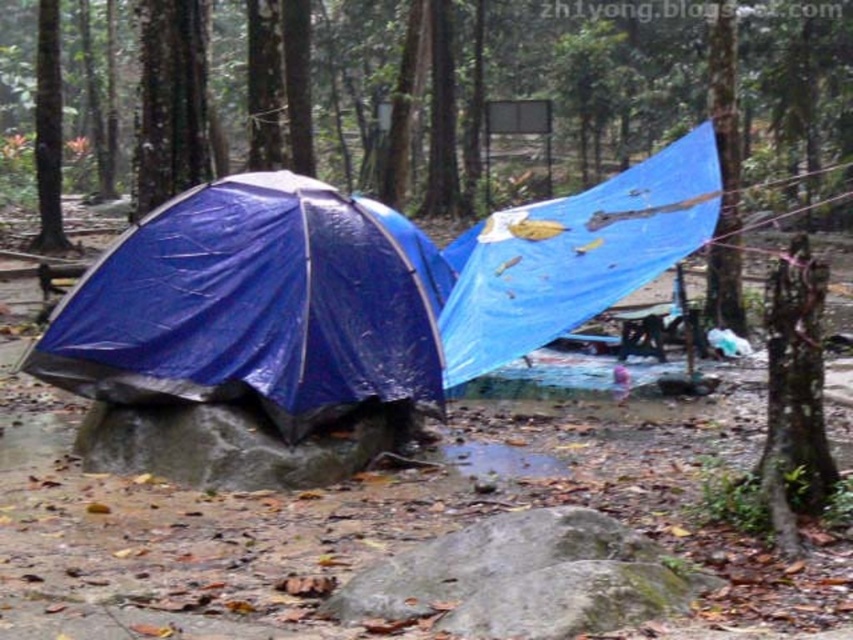
You are a hiker trying to navigate through the muddy forest to reach a campsite. You have two markers, one at point (392,356) and another at point (583,280). Which marker should you aim for first if you want to reach the campsite quickly?

You should aim for point (392,356) first because it is closer to the camera, meaning it is nearer to your current position and thus quicker to reach.

You are a hiker who needs to set up a new tent. You have a tent that requires 5 feet of clear space to pitch. Looking at the scene, can you determine if there is enough space between the blue tarpaulin tent at left and the blue tarpaulin tent at center to set up your tent?

The distance between the blue tarpaulin tent at left and the blue tarpaulin tent at center is 4.87 feet. Since your tent requires 5 feet of clear space, there isn not enough space between them to set up your tent.